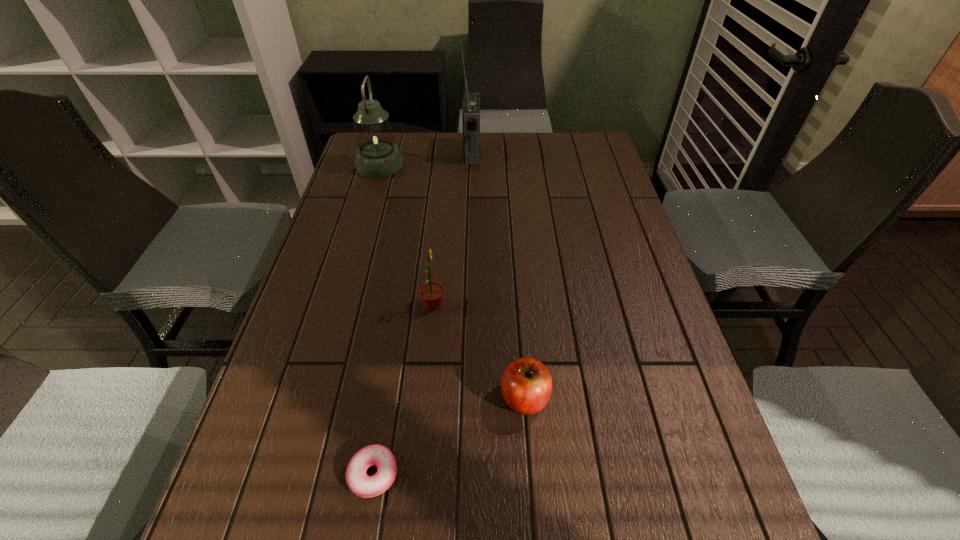
Image resolution: width=960 pixels, height=540 pixels. Find the location of `free point at the left edge`. free point at the left edge is located at coordinates (310, 270).

At what (x,y) coordinates should I click in order to perform the action: click on vacant space at the right edge of the desktop. Please return your answer as a coordinate pair (x, y). The image size is (960, 540). Looking at the image, I should click on (661, 434).

Locate an element on the screen. The height and width of the screenshot is (540, 960). free space at the far right corner of the desktop is located at coordinates (599, 140).

Where is `vacant space that is in between the second shortest object and the second object from right to left`? The width and height of the screenshot is (960, 540). vacant space that is in between the second shortest object and the second object from right to left is located at coordinates (498, 275).

I want to click on vacant area between the nearest object and the second shortest object, so pyautogui.click(x=449, y=436).

Locate an element on the screen. The height and width of the screenshot is (540, 960). unoccupied position between the apple and the second object from left to right is located at coordinates (449, 436).

Locate an element on the screen. The width and height of the screenshot is (960, 540). vacant point located between the third tallest object and the tallest object is located at coordinates click(x=452, y=228).

This screenshot has height=540, width=960. What are the coordinates of `free spot between the third farthest object and the fourth object from left to right` in the screenshot? It's located at (452, 228).

Where is `vacant space that is in between the second tallest object and the second object from left to right`? The width and height of the screenshot is (960, 540). vacant space that is in between the second tallest object and the second object from left to right is located at coordinates (376, 319).

The height and width of the screenshot is (540, 960). I want to click on empty location between the apple and the third tallest object, so click(479, 351).